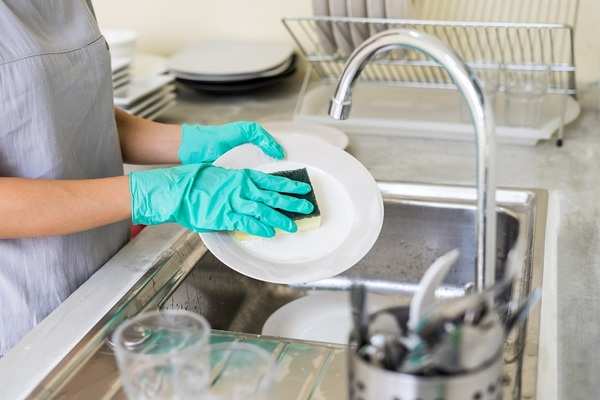
In order to click on countertop in this screenshot , I will do click(251, 100), click(574, 160), click(94, 295).